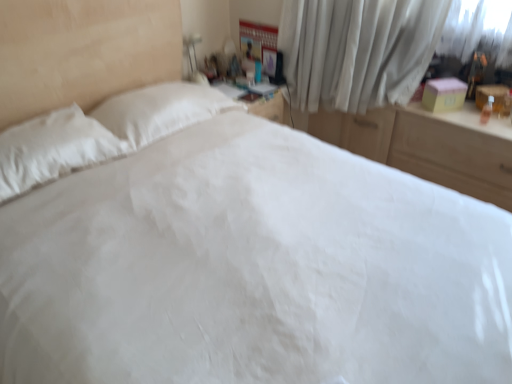
Question: Visually, is wooden dresser at right positioned to the left or to the right of white sheer curtain at upper right?

Choices:
 (A) left
 (B) right

Answer: (B)

Question: In terms of height, does wooden dresser at right look taller or shorter compared to white sheer curtain at upper right?

Choices:
 (A) short
 (B) tall

Answer: (A)

Question: Is wooden dresser at right spatially inside white sheer curtain at upper right, or outside of it?

Choices:
 (A) outside
 (B) inside

Answer: (A)

Question: From a real-world perspective, relative to wooden dresser at right, is white sheer curtain at upper right vertically above or below?

Choices:
 (A) above
 (B) below

Answer: (A)

Question: Is white sheer curtain at upper right wider or thinner than wooden dresser at right?

Choices:
 (A) wide
 (B) thin

Answer: (B)

Question: Relative to wooden dresser at right, is white sheer curtain at upper right in front or behind?

Choices:
 (A) behind
 (B) front

Answer: (A)

Question: Considering the positions of white sheer curtain at upper right and wooden dresser at right in the image, is white sheer curtain at upper right bigger or smaller than wooden dresser at right?

Choices:
 (A) big
 (B) small

Answer: (B)